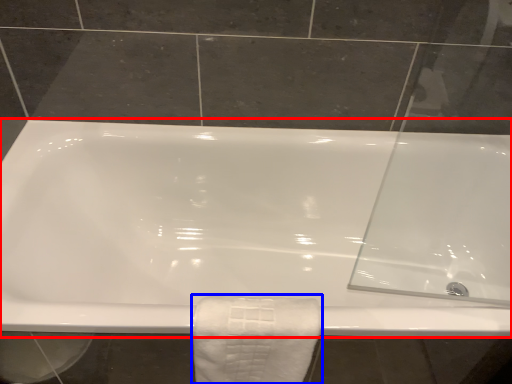
Question: Which object appears farthest to the camera in this image, bathtub (highlighted by a red box) or towel (highlighted by a blue box)?

Choices:
 (A) bathtub
 (B) towel

Answer: (A)